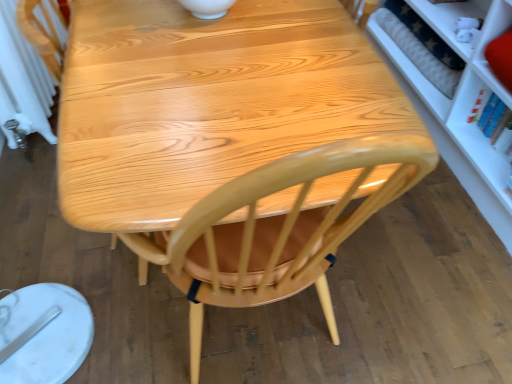
Question: Is white radiator at left taller than glossy wood chair at center?

Choices:
 (A) yes
 (B) no

Answer: (A)

Question: Considering the relative positions of white radiator at left and glossy wood chair at center in the image provided, is white radiator at left in front of glossy wood chair at center?

Choices:
 (A) yes
 (B) no

Answer: (B)

Question: Is glossy wood chair at center at the back of white radiator at left?

Choices:
 (A) no
 (B) yes

Answer: (A)

Question: From a real-world perspective, is white radiator at left on top of glossy wood chair at center?

Choices:
 (A) yes
 (B) no

Answer: (A)

Question: Is white radiator at left shorter than glossy wood chair at center?

Choices:
 (A) yes
 (B) no

Answer: (B)

Question: Could you tell me if white radiator at left is facing glossy wood chair at center?

Choices:
 (A) no
 (B) yes

Answer: (A)

Question: Is the position of glossy wood chair at center more distant than that of white radiator at left?

Choices:
 (A) yes
 (B) no

Answer: (B)

Question: Is glossy wood chair at center to the right of white radiator at left from the viewer's perspective?

Choices:
 (A) yes
 (B) no

Answer: (A)

Question: From a real-world perspective, is glossy wood chair at center on white radiator at left?

Choices:
 (A) no
 (B) yes

Answer: (A)

Question: From the image's perspective, is glossy wood chair at center beneath white radiator at left?

Choices:
 (A) yes
 (B) no

Answer: (A)

Question: Does glossy wood chair at center turn towards white radiator at left?

Choices:
 (A) no
 (B) yes

Answer: (A)

Question: From the image's perspective, is glossy wood chair at center located above white radiator at left?

Choices:
 (A) yes
 (B) no

Answer: (B)

Question: In the image, is glossy wood chair at center on the left side or the right side of white radiator at left?

Choices:
 (A) left
 (B) right

Answer: (B)